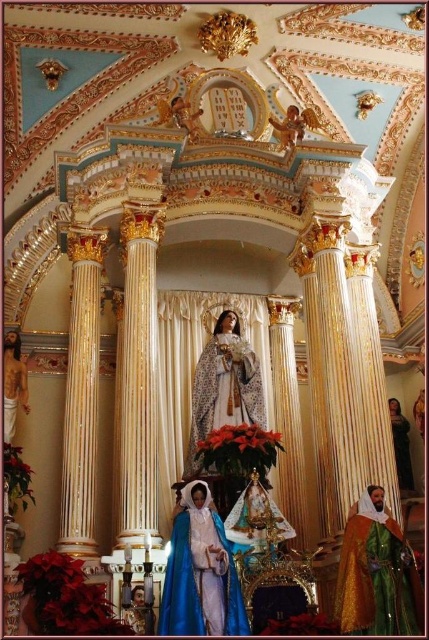
You are an art student observing the church altar. You notice the smooth golden statue at lower left and the dark blue velvet robe at right. Which object is closer to you from your viewpoint?

The smooth golden statue at lower left is closer to you because it is positioned in front of the dark blue velvet robe at right.

You are an art restorer tasked with moving the blue velvet statue at center and the smooth golden statue at lower left to a storage room. The storage room has a narrow doorway that can only accommodate items up to 1 meter in width. Based on the information provided, can both statues fit through the doorway individually?

The blue velvet statue at center might be wider than smooth golden statue at lower left, so the blue velvet statue at center may not fit through the doorway if it exceeds 1 meter in width. The smooth golden statue at lower left is likely narrower and could fit. Each should be measured individually to confirm.

You are standing in the church and want to take a closer look at both the matte white statue at center and the smooth golden statue at lower left. Which statue should you approach first to be closer to it without moving your position?

The matte white statue at center is closer to the viewer than the smooth golden statue at lower left, so you should approach the matte white statue at center first to be closer without moving your position.